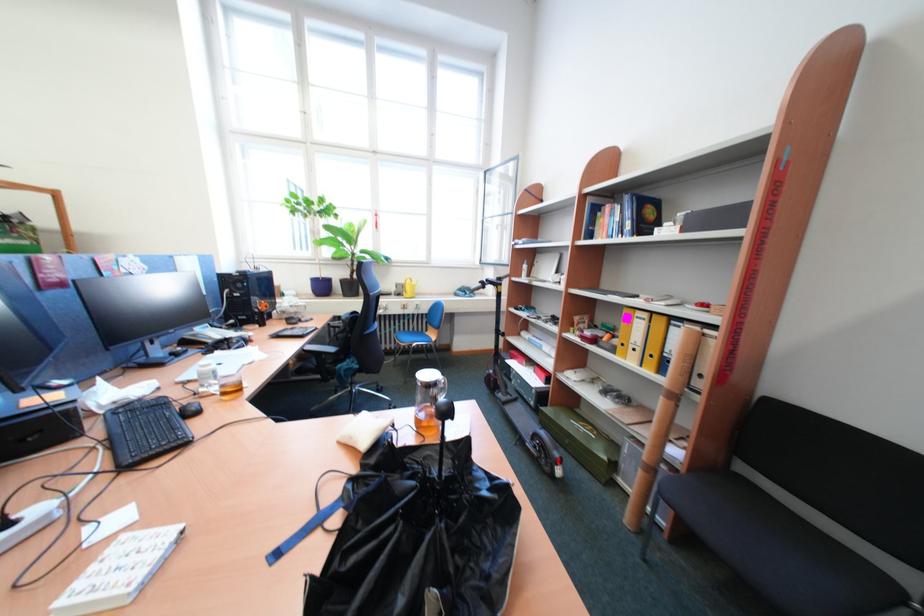
You are a GUI agent. You are given a task and a screenshot of the screen. Output one action in this format:
    pyautogui.click(x=<x>, y=<y>)
    Task: Click on the blue chair sitting surface
    The image size is (924, 616).
    Given the screenshot: What is the action you would take?
    pyautogui.click(x=415, y=338)